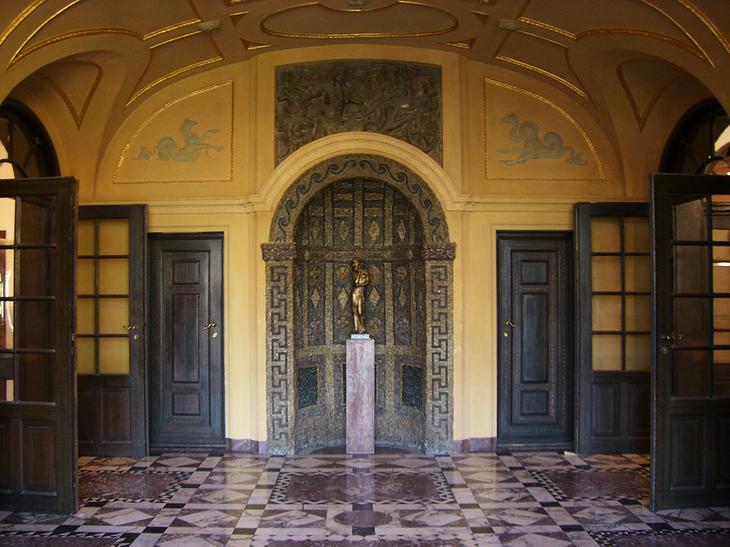
The height and width of the screenshot is (547, 730). I want to click on wall, so click(184, 110).